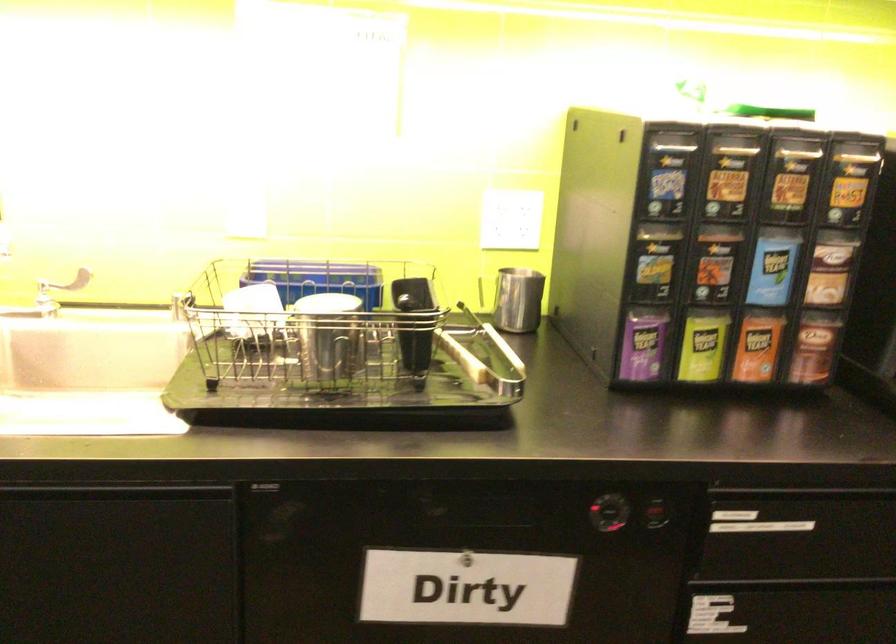
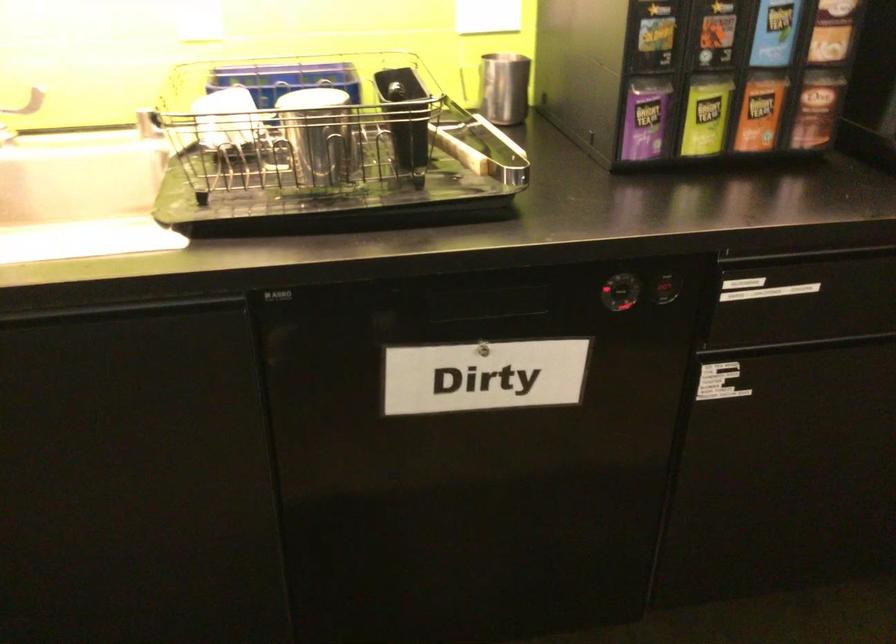
In a continuous first-person perspective shot, in which direction is the camera moving?

The movement direction of the cameraman is left, forward.